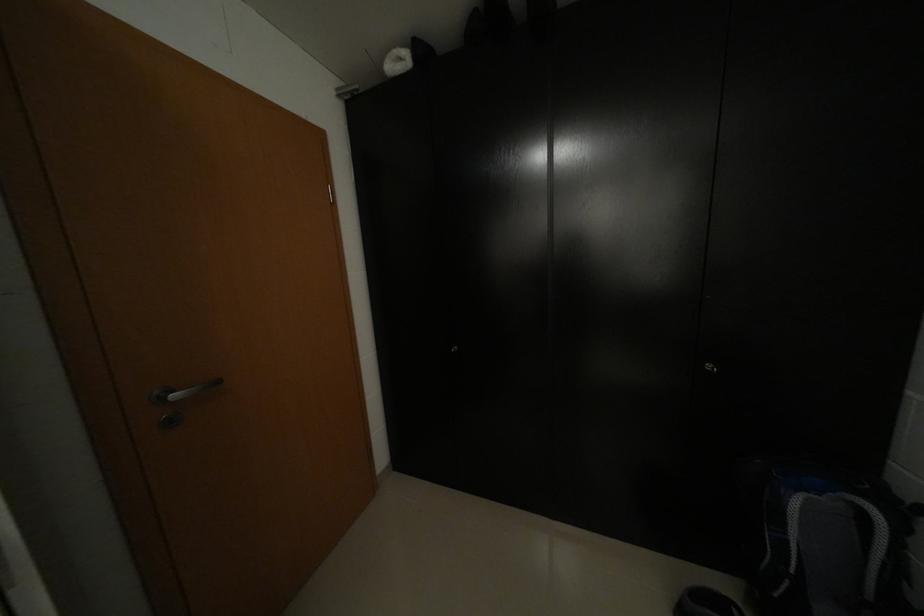
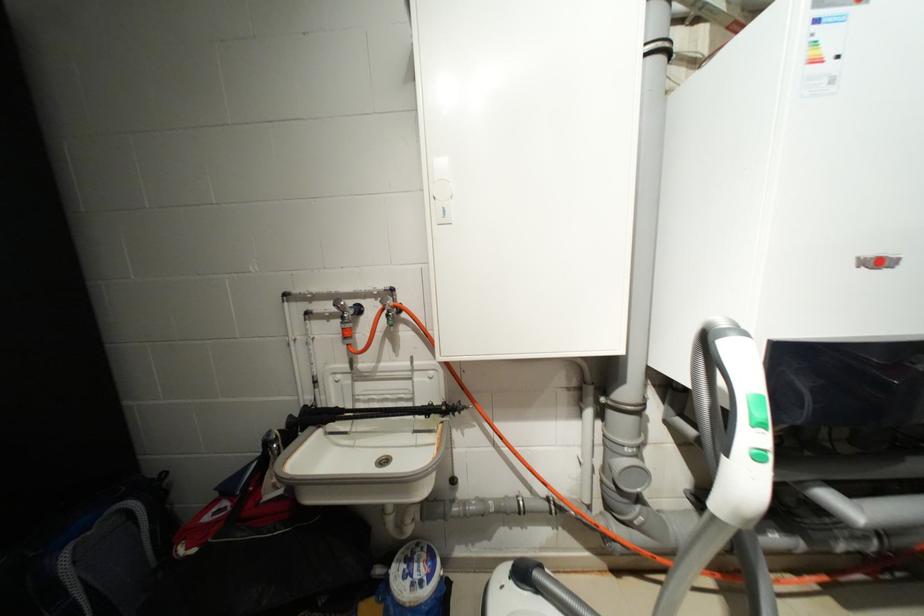
Question: The first image is from the beginning of the video and the second image is from the end. How did the camera likely rotate when shooting the video?

Choices:
 (A) Left
 (B) Right
 (C) Up
 (D) Down

Answer: (B)